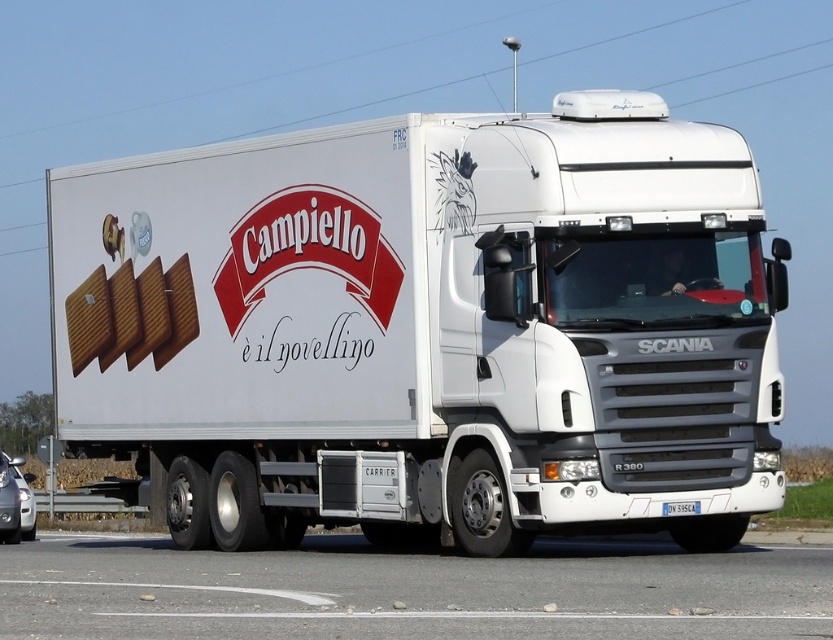
How much distance is there between silver metallic car at lower left and white plastic license plate at center?

silver metallic car at lower left and white plastic license plate at center are 14.58 meters apart.

Is silver metallic car at lower left positioned in front of white plastic license plate at center?

That is False.

What do you see at coordinates (23, 497) in the screenshot? I see `silver metallic car at lower left` at bounding box center [23, 497].

Locate an element on the screen. silver metallic car at lower left is located at coordinates (23, 497).

Which of these two, white matte truck at center or asphalt at lower center, stands taller?

Standing taller between the two is white matte truck at center.

Does white matte truck at center come in front of asphalt at lower center?

No, it is not.

Between point (60, 397) and point (621, 611), which one is positioned behind?

Positioned behind is point (60, 397).

Where is `white matte truck at center`? white matte truck at center is located at coordinates (427, 326).

Can you confirm if white matte truck at center is smaller than silver metallic car at lower left?

Correct, white matte truck at center occupies less space than silver metallic car at lower left.

The width and height of the screenshot is (833, 640). What do you see at coordinates (427, 326) in the screenshot?
I see `white matte truck at center` at bounding box center [427, 326].

Find the location of a particular element. white matte truck at center is located at coordinates (427, 326).